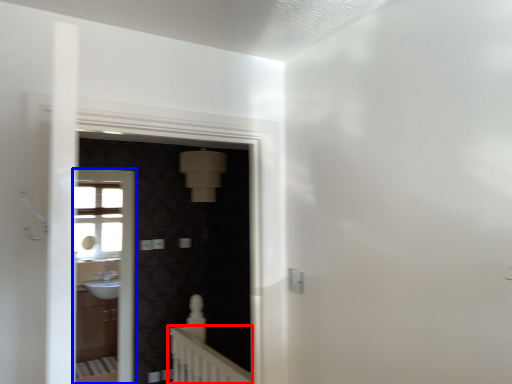
Question: Which of the following is the farthest to the observer, balustrade (highlighted by a red box) or screen door (highlighted by a blue box)?

Choices:
 (A) balustrade
 (B) screen door

Answer: (B)